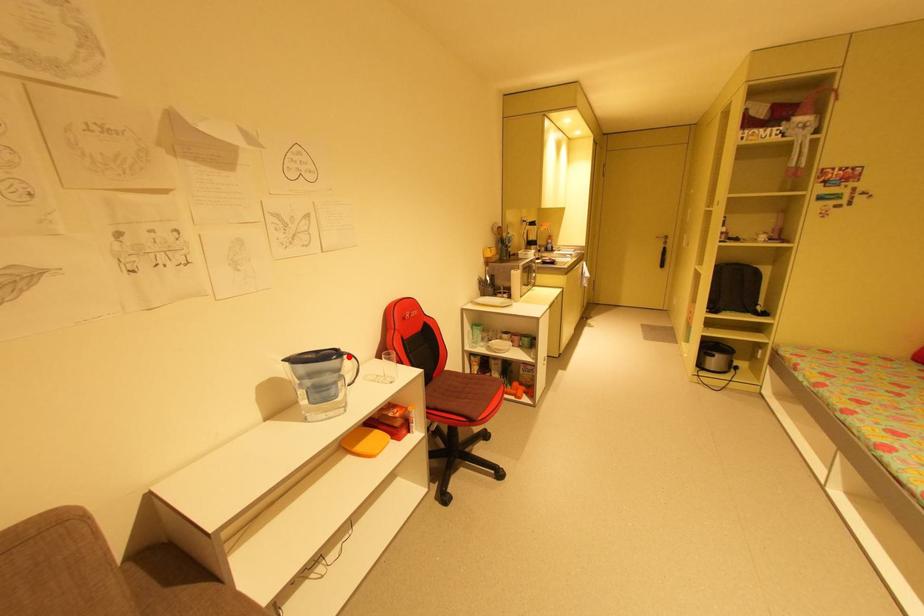
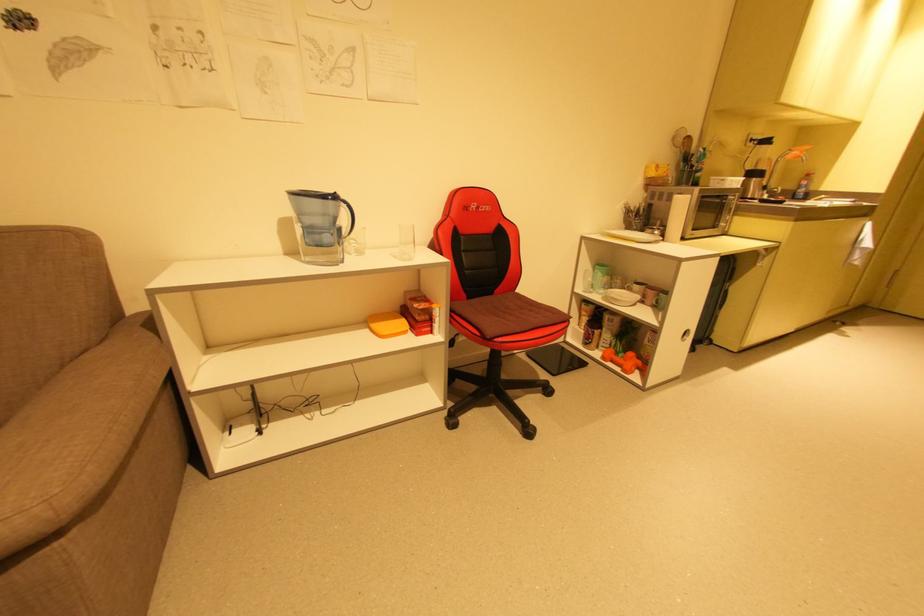
Question: I am providing you with two images of the same scene from different viewpoints. A red point is shown in image1. For the corresponding object point in image2, is it positioned nearer or farther from the camera?

Choices:
 (A) Nearer
 (B) Farther

Answer: (B)